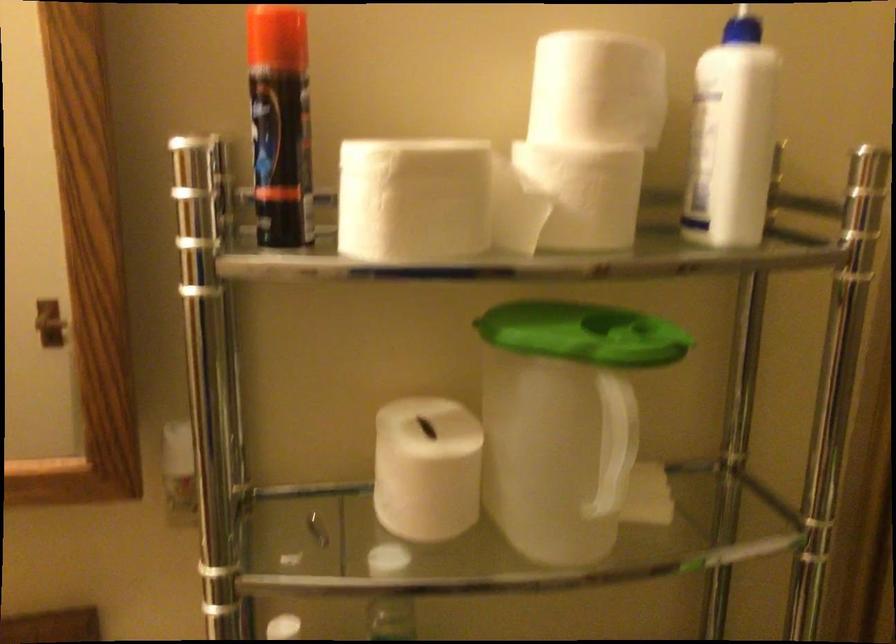
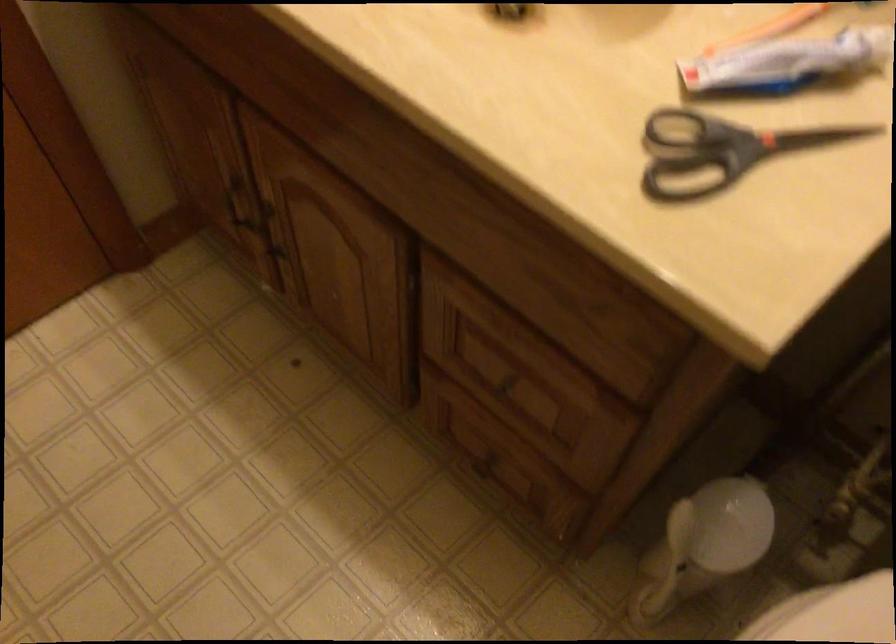
How did the camera likely rotate?

The camera's rotation is toward left-down.